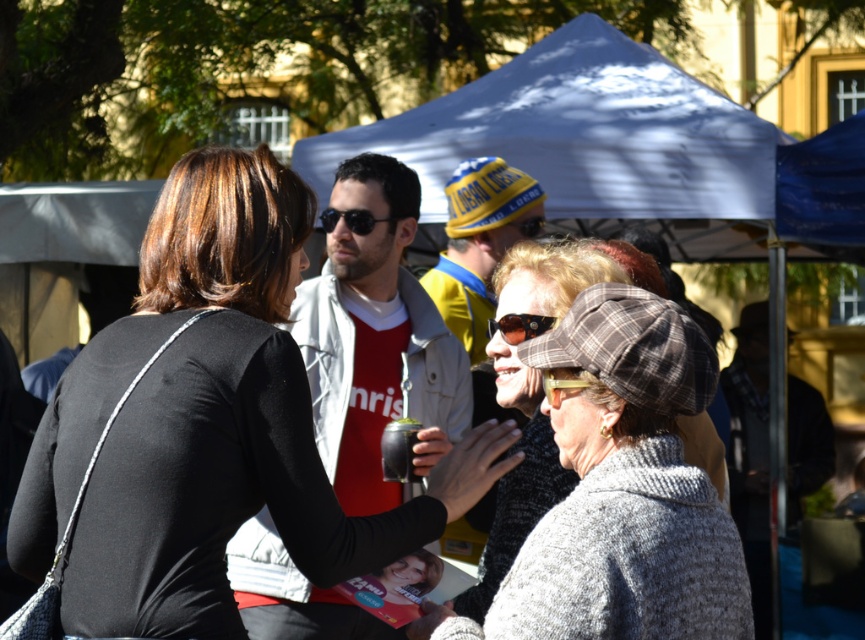
You are organizing a photo shoot and need to ensure that the black matte jacket at center and the plaid woolen hat at center can fit within a rectangular frame that is 1 meter wide. Given their sizes, will both items fit side by side horizontally within the frame?

The black matte jacket at center is wider than the plaid woolen hat at center. To determine if they can fit side by side, we need to know the combined width of both items. However, the exact widths are not provided, only the comparison. Without specific measurements, it is impossible to confirm if their combined width exceeds 1 meter. Additional information about their individual dimensions is required to make this assessment.

You are a photographer trying to capture a candid shot of the person wearing the plaid woolen hat at center and the sunglasses at center. To ensure both are in frame, you need to know their relative positions. Which object is positioned to the left of the other?

The plaid woolen hat at center is to the left of the sunglasses at center.

You are a photographer trying to capture both the matte black mate cup at center and the black reflective sunglasses at center in a single shot. Since both are at the center, you need to adjust your camera angle to ensure both are fully visible. Which object should you angle the camera upwards to focus on, and downwards to frame the other?

To capture both the matte black mate cup at center and the black reflective sunglasses at center, you should angle the camera upwards to focus on the matte black mate cup at center since it is taller than the black reflective sunglasses at center. This way, the sunglasses will be visible at the bottom of the frame while the cup occupies the upper part without being cut off.